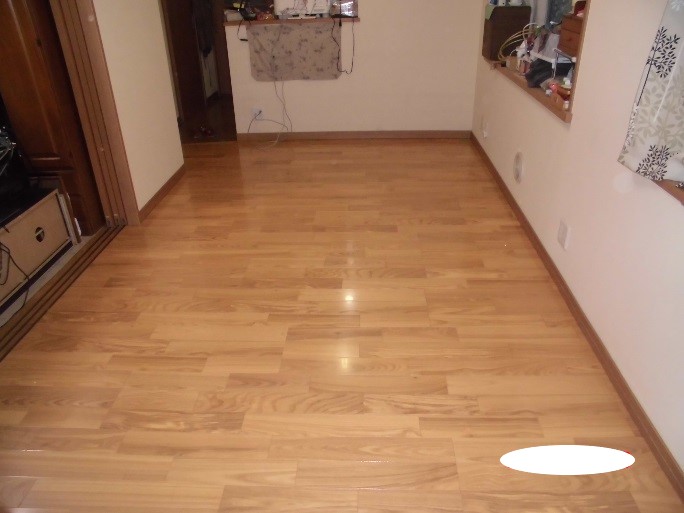
At what (x,y) coordinates should I click in order to perform the action: click on bar. Please return your answer as a coordinate pair (x, y). The height and width of the screenshot is (513, 684). Looking at the image, I should click on (535, 67).